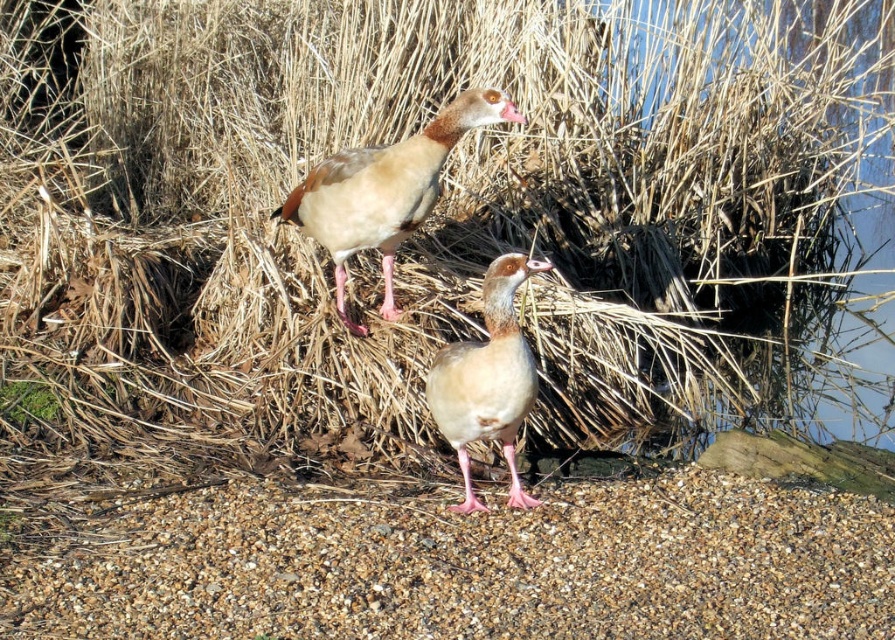
You are a birdwatcher observing the scene from the edge of the water. You notice the brown gravel at lower center and the brown feathered duck at upper center. Which object is located closer to the ground?

The brown gravel at lower center is positioned under the brown feathered duck at upper center, so it is closer to the ground.

You are a wildlife photographer aiming to capture both the brown feathered duck at upper center and the brown feathered duck at center in a single shot. Given that your camera has a focal length of 50mm, which is suitable for capturing subjects within a 10 feet range, can you include both ducks in your photo without moving your position?

The brown feathered duck at upper center and brown feathered duck at center are 3.36 feet apart, which is well within the 10 feet range of the 50mm focal length camera. Therefore, you can include both ducks in your photo without moving your position.

Consider the image. You are a photographer trying to capture the Egyptian geese in the image. You notice two points marked in the scene. Which point, point (229, 598) or point (453, 342), is closer to your camera lens?

Point (229, 598) is closer to the camera lens than point (453, 342).